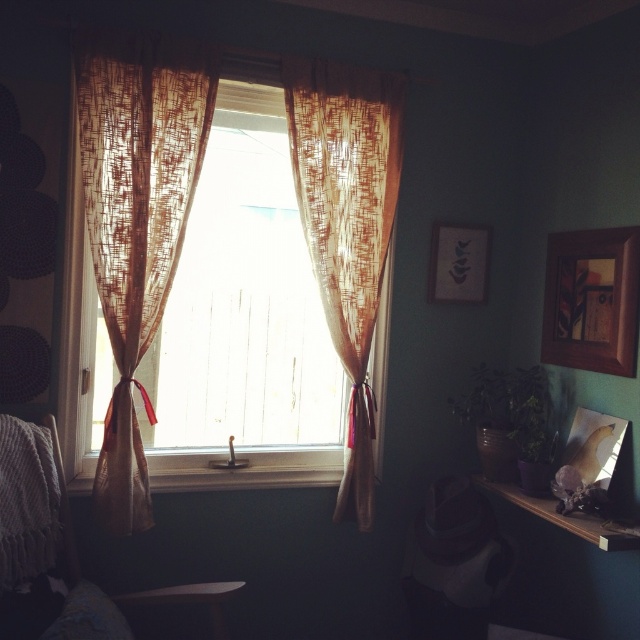
Question: Which point appears farthest from the camera in this image?

Choices:
 (A) (349, 422)
 (B) (442, 260)
 (C) (625, 324)

Answer: (B)

Question: Does matte wooden picture frame at upper right have a smaller size compared to wooden shelf at lower right?

Choices:
 (A) no
 (B) yes

Answer: (B)

Question: Does translucent brown curtains at center lie in front of translucent brown curtain at left?

Choices:
 (A) yes
 (B) no

Answer: (B)

Question: Which of the following is the farthest from the observer?

Choices:
 (A) translucent brown curtains at center
 (B) translucent brown curtain at center
 (C) matte wooden picture frame at upper right
 (D) wooden shelf at lower right

Answer: (C)

Question: Does wooden picture frame at upper right have a smaller size compared to matte wooden picture frame at upper right?

Choices:
 (A) no
 (B) yes

Answer: (A)

Question: Based on their relative distances, which object is nearer to the matte wooden picture frame at upper right?

Choices:
 (A) wooden shelf at lower right
 (B) translucent brown curtain at left
 (C) translucent brown curtains at center

Answer: (C)